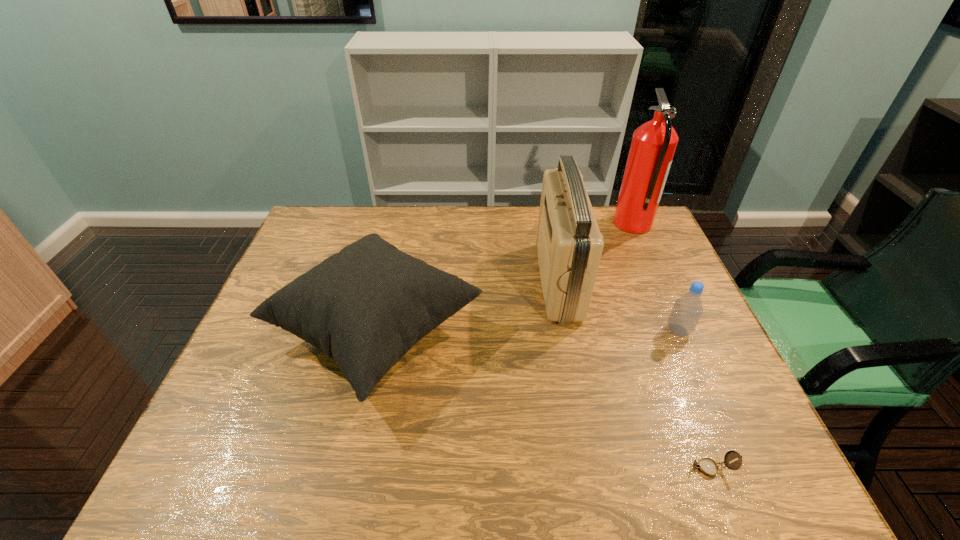
The width and height of the screenshot is (960, 540). In order to click on fire extinguisher that is at the far edge in this screenshot , I will do `click(653, 145)`.

Find the location of a particular element. The image size is (960, 540). radio receiver located at the far edge is located at coordinates (569, 243).

The width and height of the screenshot is (960, 540). In order to click on object situated at the near edge in this screenshot , I will do `click(707, 466)`.

The width and height of the screenshot is (960, 540). What are the coordinates of `object located at the left edge` in the screenshot? It's located at (366, 306).

The height and width of the screenshot is (540, 960). Find the location of `fire extinguisher that is at the right edge`. fire extinguisher that is at the right edge is located at coordinates (653, 145).

Identify the location of bottle that is at the right edge. (687, 310).

Identify the location of compass situated at the right edge. (707, 466).

Where is `object that is positioned at the far right corner`? The width and height of the screenshot is (960, 540). object that is positioned at the far right corner is located at coordinates (653, 145).

Locate an element on the screen. The image size is (960, 540). object present at the near right corner is located at coordinates (707, 466).

The width and height of the screenshot is (960, 540). I want to click on vacant area at the far edge of the desktop, so click(x=605, y=244).